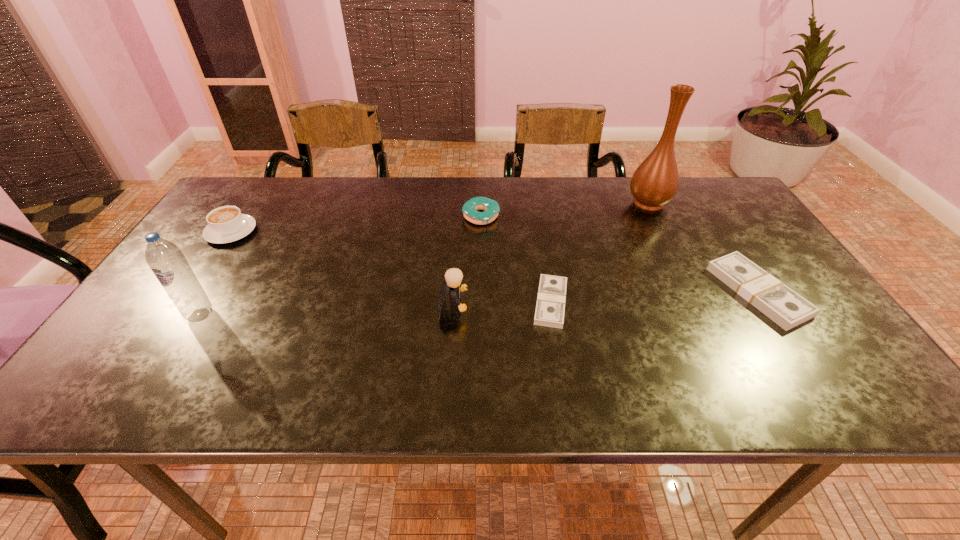
The image size is (960, 540). Identify the location of free location located on the front of the taller dollar. point(798,353).

The image size is (960, 540). I want to click on vacant space positioned on the side of the fourth shortest object with the handle, so click(248, 208).

This screenshot has width=960, height=540. I want to click on free spot located on the side of the fourth shortest object with the handle, so click(x=258, y=192).

Identify the location of free point located 0.090m on the side of the fourth shortest object with the handle. (252, 201).

You are a GUI agent. You are given a task and a screenshot of the screen. Output one action in this format:
    pyautogui.click(x=<x>, y=<y>)
    Task: Click on the vacant space located 0.310m on the front of the doughnut
    Image resolution: width=960 pixels, height=540 pixels.
    Given the screenshot: What is the action you would take?
    pyautogui.click(x=481, y=307)

You are a GUI agent. You are given a task and a screenshot of the screen. Output one action in this format:
    pyautogui.click(x=<x>, y=<y>)
    Task: Click on the free location located on the right of the vase
    This screenshot has width=960, height=540.
    Given the screenshot: What is the action you would take?
    pyautogui.click(x=723, y=202)

Find the location of a particular element. The width and height of the screenshot is (960, 540). free space located on the right of the water bottle is located at coordinates (240, 315).

In order to click on free space located 0.310m on the front-facing side of the third tallest object in this screenshot , I will do `click(598, 307)`.

Locate an element on the screen. cappuccino located in the far edge section of the desktop is located at coordinates (226, 224).

Locate an element on the screen. The height and width of the screenshot is (540, 960). doughnut that is positioned at the far edge is located at coordinates (491, 208).